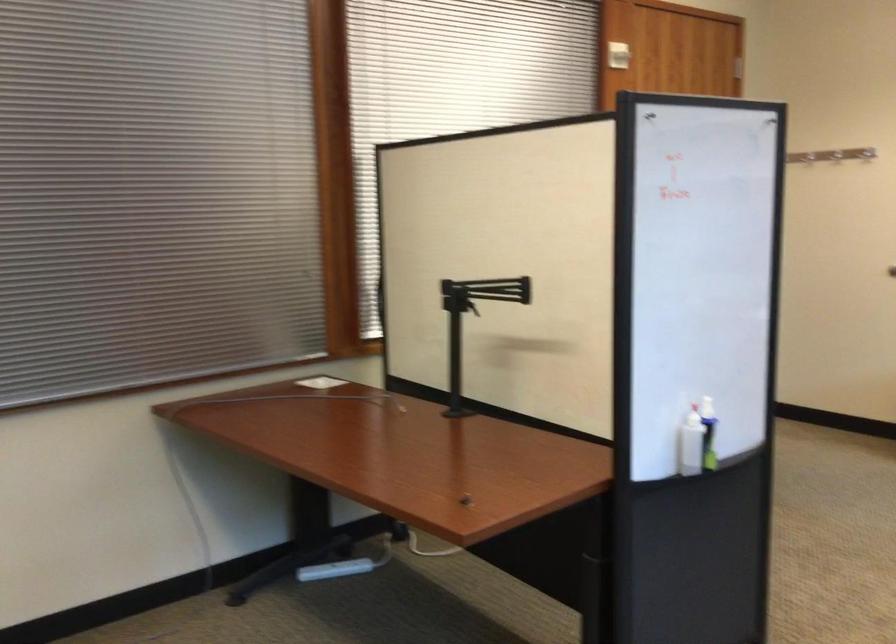
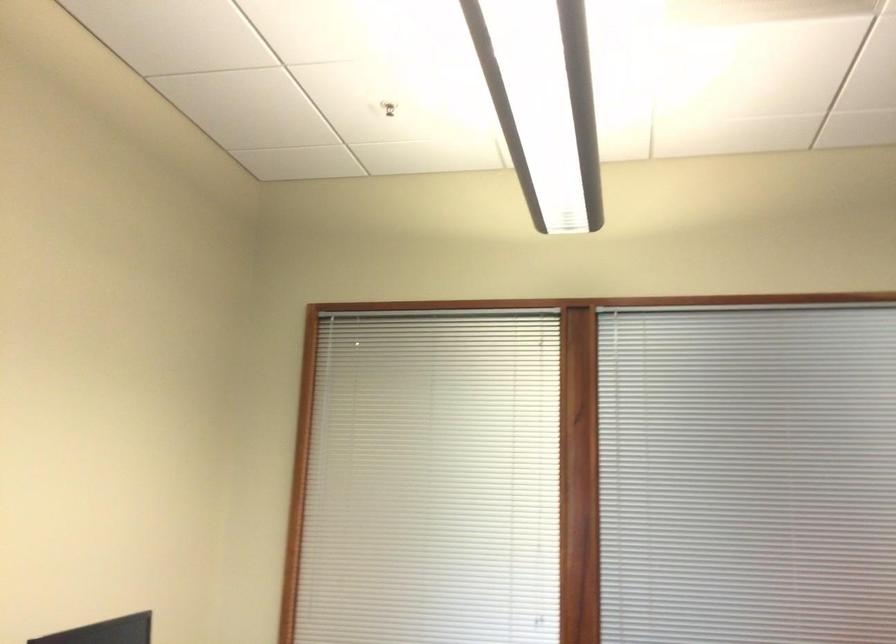
Question: The camera is either moving clockwise (left) or counter-clockwise (right) around the object. The first image is from the beginning of the video and the second image is from the end. Is the camera moving left or right when shooting the video?

Choices:
 (A) Left
 (B) Right

Answer: (B)